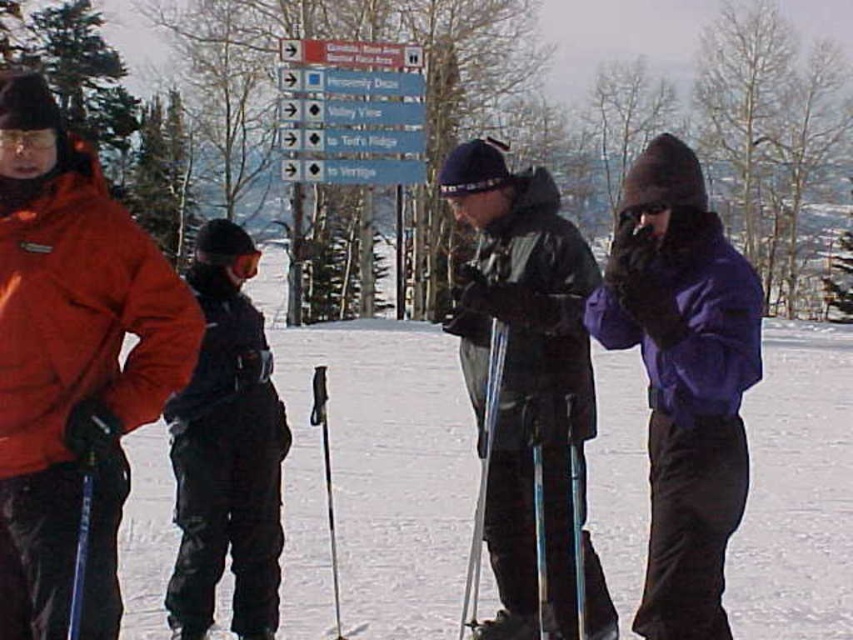
Does matte black ski pole at center appear on the right side of blue metallic ski pole at center?

Indeed, matte black ski pole at center is positioned on the right side of blue metallic ski pole at center.

Is the position of matte black ski pole at center less distant than that of blue metallic ski pole at center?

No, matte black ski pole at center is further to the viewer.

Is point (503, 304) closer to viewer compared to point (476, 500)?

Yes, it is in front of point (476, 500).

This screenshot has height=640, width=853. I want to click on matte black ski pole at center, so click(524, 372).

Find the location of a particular element. black matte ski pants at center is located at coordinates (225, 451).

Which is behind, point (231, 476) or point (482, 512)?

Point (231, 476)

I want to click on black matte ski pants at center, so click(225, 451).

Does matte black ski pole at center have a larger size compared to black matte ski pants at center?

Indeed, matte black ski pole at center has a larger size compared to black matte ski pants at center.

Who is shorter, matte black ski pole at center or black matte ski pants at center?

With less height is black matte ski pants at center.

Which is behind, point (579, 472) or point (207, 241)?

The point (207, 241) is more distant.

At what (x,y) coordinates should I click in order to perform the action: click on matte black ski pole at center. Please return your answer as a coordinate pair (x, y). Looking at the image, I should click on (524, 372).